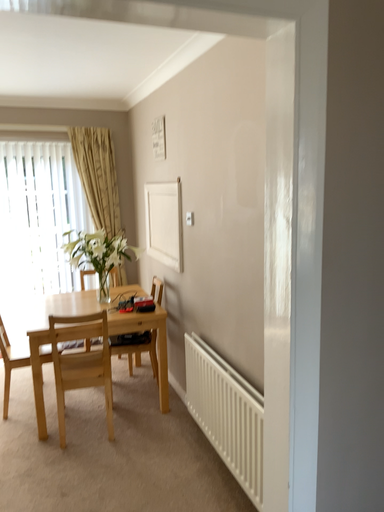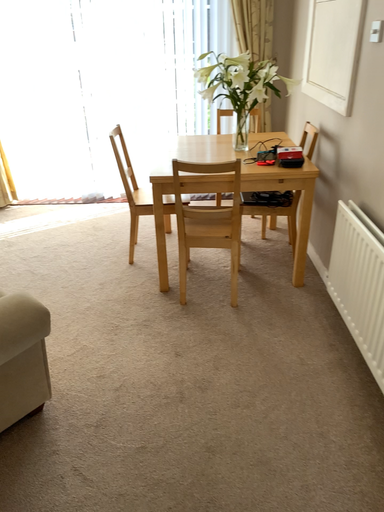
Question: Which way did the camera rotate in the video?

Choices:
 (A) rotated downward
 (B) rotated upward

Answer: (A)